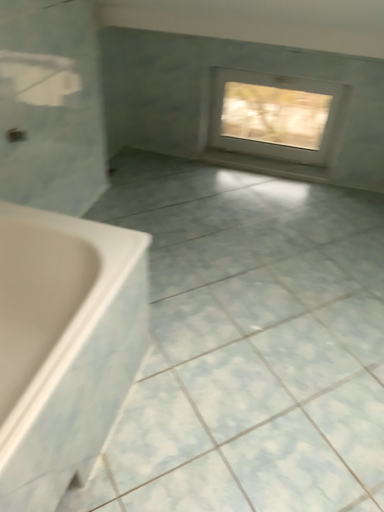
Measure the distance between white frosted glass window at upper center and camera.

white frosted glass window at upper center is 8.07 feet from camera.

Based on the photo, what is the approximate height of white glossy ceramic tile at center?

white glossy ceramic tile at center is 1.75 inches in height.

You are a GUI agent. You are given a task and a screenshot of the screen. Output one action in this format:
    pyautogui.click(x=<x>, y=<y>)
    Task: Click on the white frosted glass window at upper center
    The height and width of the screenshot is (512, 384).
    Given the screenshot: What is the action you would take?
    pyautogui.click(x=275, y=115)

Can you confirm if white glossy ceramic tile at center is wider than white plastic bathtub at lower left?

Yes.

Image resolution: width=384 pixels, height=512 pixels. Identify the location of ceramic tile behind the white plastic bathtub at lower left. (249, 345).

Which is in front, white glossy ceramic tile at center or white plastic bathtub at lower left?

white plastic bathtub at lower left is in front.

Which is correct: white frosted glass window at upper center is inside white plastic bathtub at lower left, or outside of it?

white frosted glass window at upper center lies outside white plastic bathtub at lower left.

Is white frosted glass window at upper center to the right of white plastic bathtub at lower left from the viewer's perspective?

Indeed, white frosted glass window at upper center is positioned on the right side of white plastic bathtub at lower left.

Which object is further away from the camera taking this photo, white frosted glass window at upper center or white plastic bathtub at lower left?

white frosted glass window at upper center.

From a real-world perspective, is white frosted glass window at upper center physically above white plastic bathtub at lower left?

Yes, from a real-world perspective, white frosted glass window at upper center is over white plastic bathtub at lower left

Does white frosted glass window at upper center lie in front of white glossy ceramic tile at center?

That is False.

Which object is thinner, white frosted glass window at upper center or white glossy ceramic tile at center?

white frosted glass window at upper center.

Is white glossy ceramic tile at center inside white frosted glass window at upper center?

No, white glossy ceramic tile at center is located outside of white frosted glass window at upper center.

Is white plastic bathtub at lower left oriented away from white frosted glass window at upper center?

That's not correct — white plastic bathtub at lower left is not looking away from white frosted glass window at upper center.

Which of these two, white plastic bathtub at lower left or white frosted glass window at upper center, is wider?

white plastic bathtub at lower left is wider.

From a real-world perspective, who is located higher, white plastic bathtub at lower left or white frosted glass window at upper center?

white frosted glass window at upper center is physically above.

Which is correct: white plastic bathtub at lower left is inside white frosted glass window at upper center, or outside of it?

white plastic bathtub at lower left is not enclosed by white frosted glass window at upper center.

This screenshot has width=384, height=512. In order to click on ceramic tile above the white plastic bathtub at lower left (from the image's perspective) in this screenshot , I will do `click(249, 345)`.

Considering the points (74, 408) and (153, 483), which point is behind, point (74, 408) or point (153, 483)?

The point (153, 483) is more distant.

From a real-world perspective, is white glossy ceramic tile at center physically located above or below white frosted glass window at upper center?

From a real-world perspective, white glossy ceramic tile at center is physically below white frosted glass window at upper center.

Is point (171, 330) less distant than point (233, 130)?

Yes, it is in front of point (233, 130).

Is white frosted glass window at upper center at the back of white glossy ceramic tile at center?

white glossy ceramic tile at center does not have its back to white frosted glass window at upper center.

Between white glossy ceramic tile at center and white frosted glass window at upper center, which one has more height?

Standing taller between the two is white frosted glass window at upper center.

The height and width of the screenshot is (512, 384). Find the location of `ceramic tile located underneath the white plastic bathtub at lower left (from a real-world perspective)`. ceramic tile located underneath the white plastic bathtub at lower left (from a real-world perspective) is located at coordinates (249, 345).

In order to click on bathtub located on the left of white frosted glass window at upper center in this screenshot , I will do `click(64, 346)`.

Looking at the image, which one is located further to white plastic bathtub at lower left, white frosted glass window at upper center or white glossy ceramic tile at center?

white frosted glass window at upper center.

Looking at the image, which one is located closer to white plastic bathtub at lower left, white glossy ceramic tile at center or white frosted glass window at upper center?

Based on the image, white glossy ceramic tile at center appears to be nearer to white plastic bathtub at lower left.

Looking at the image, which one is located further to white glossy ceramic tile at center, white plastic bathtub at lower left or white frosted glass window at upper center?

The object further to white glossy ceramic tile at center is white frosted glass window at upper center.

Based on their spatial positions, is white plastic bathtub at lower left or white glossy ceramic tile at center closer to white frosted glass window at upper center?

white glossy ceramic tile at center is closer to white frosted glass window at upper center.

Considering their positions, is white frosted glass window at upper center positioned further to white glossy ceramic tile at center than white plastic bathtub at lower left?

white frosted glass window at upper center lies further to white glossy ceramic tile at center than the other object.

Based on their spatial positions, is white glossy ceramic tile at center or white plastic bathtub at lower left further from white frosted glass window at upper center?

Based on the image, white plastic bathtub at lower left appears to be further to white frosted glass window at upper center.

This screenshot has width=384, height=512. Find the location of `ceramic tile between white plastic bathtub at lower left and white frosted glass window at upper center in the front-back direction`. ceramic tile between white plastic bathtub at lower left and white frosted glass window at upper center in the front-back direction is located at coordinates (249, 345).